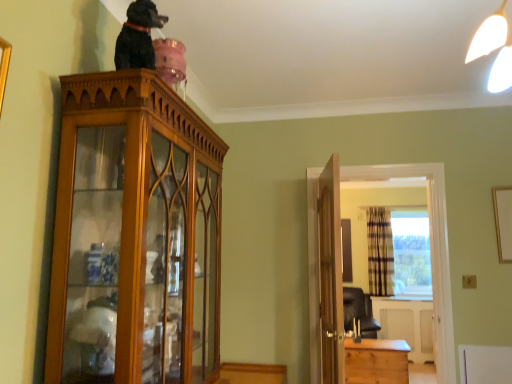
Question: Is light brown wooden chest at lower right not close to wooden door at center?

Choices:
 (A) yes
 (B) no

Answer: (A)

Question: From a real-world perspective, is light brown wooden chest at lower right under wooden door at center?

Choices:
 (A) no
 (B) yes

Answer: (B)

Question: Does light brown wooden chest at lower right have a greater height compared to wooden door at center?

Choices:
 (A) no
 (B) yes

Answer: (A)

Question: Does light brown wooden chest at lower right have a greater width compared to wooden door at center?

Choices:
 (A) no
 (B) yes

Answer: (B)

Question: Is light brown wooden chest at lower right oriented towards wooden door at center?

Choices:
 (A) yes
 (B) no

Answer: (B)

Question: In the image, is transparent glass window at center on the left side or the right side of plaid fabric curtain at right?

Choices:
 (A) left
 (B) right

Answer: (B)

Question: Is transparent glass window at center wider or thinner than plaid fabric curtain at right?

Choices:
 (A) thin
 (B) wide

Answer: (A)

Question: Does point (373, 258) appear closer or farther from the camera than point (385, 274)?

Choices:
 (A) closer
 (B) farther

Answer: (A)

Question: Considering their positions, is transparent glass window at center located in front of or behind plaid fabric curtain at right?

Choices:
 (A) behind
 (B) front

Answer: (B)

Question: Considering the positions of wooden cabinet at right and wooden door at center in the image, is wooden cabinet at right wider or thinner than wooden door at center?

Choices:
 (A) wide
 (B) thin

Answer: (A)

Question: From a real-world perspective, is wooden cabinet at right above or below wooden door at center?

Choices:
 (A) below
 (B) above

Answer: (B)

Question: Is wooden cabinet at right to the left or to the right of wooden door at center in the image?

Choices:
 (A) left
 (B) right

Answer: (B)

Question: Is wooden cabinet at right situated inside wooden door at center or outside?

Choices:
 (A) outside
 (B) inside

Answer: (A)

Question: Is transparent glass window at center wider or thinner than wooden door at center?

Choices:
 (A) thin
 (B) wide

Answer: (B)

Question: Would you say transparent glass window at center is to the left or to the right of wooden door at center in the picture?

Choices:
 (A) left
 (B) right

Answer: (B)